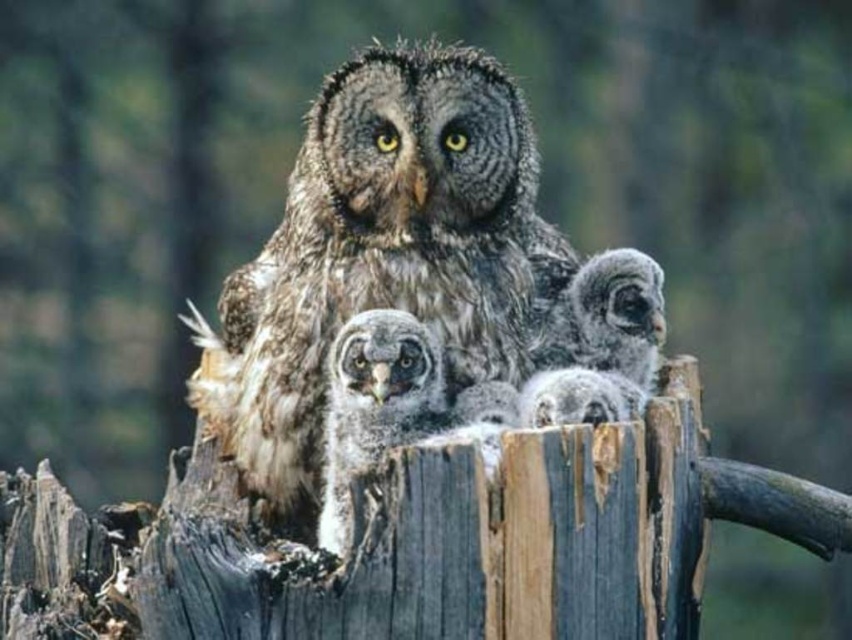
In the scene of the adult owl and its three chicks on the wooden stump, you need to determine which owl is the parent based on size differences. The speckled brown owl at center and the speckled gray owl at center are both present. Which one is likely the adult?

The speckled brown owl at center is taller than the speckled gray owl at center, so the speckled brown owl at center is likely the adult.

You are an ornithologist observing the owls on the wooden stump. You need to determine which owl has a larger width between the speckled brown owl at center and the speckled gray owl at center based on the scene. Which one is wider?

The speckled brown owl at center is wider than the speckled gray owl at center according to the description.